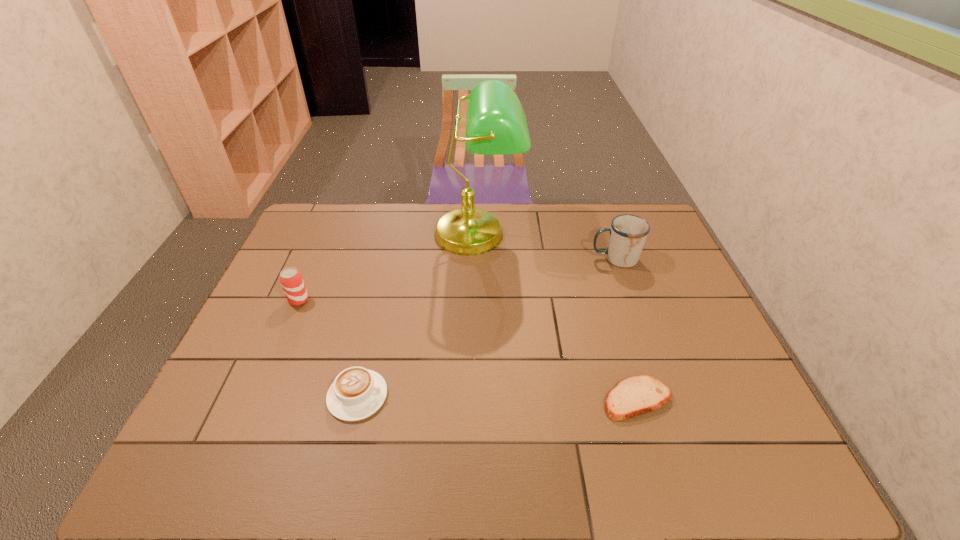
I want to click on vacant space located on the handle side of the mug, so click(551, 259).

Where is `vacant space positioned 0.250m on the handle side of the mug`? vacant space positioned 0.250m on the handle side of the mug is located at coordinates (514, 259).

Locate an element on the screen. The height and width of the screenshot is (540, 960). vacant space located on the right of the third farthest object is located at coordinates (373, 300).

At what (x,y) coordinates should I click in order to perform the action: click on free point located 0.110m with the handle on the right side of the fourth tallest object. Please return your answer as a coordinate pair (x, y). Looking at the image, I should click on (433, 396).

Find the location of a particular element. free spot located 0.350m on the back of the pita bread is located at coordinates (602, 282).

Identify the location of object located in the far edge section of the desktop. (496, 124).

Locate an element on the screen. object that is at the left edge is located at coordinates (291, 280).

You are a GUI agent. You are given a task and a screenshot of the screen. Output one action in this format:
    pyautogui.click(x=<x>, y=<y>)
    Task: Click on the object that is at the right edge
    Image resolution: width=960 pixels, height=540 pixels.
    Given the screenshot: What is the action you would take?
    pyautogui.click(x=628, y=233)

Locate an element on the screen. The width and height of the screenshot is (960, 540). free region at the far edge of the desktop is located at coordinates coord(356,224).

Where is `blank space at the left edge`? blank space at the left edge is located at coordinates (291, 339).